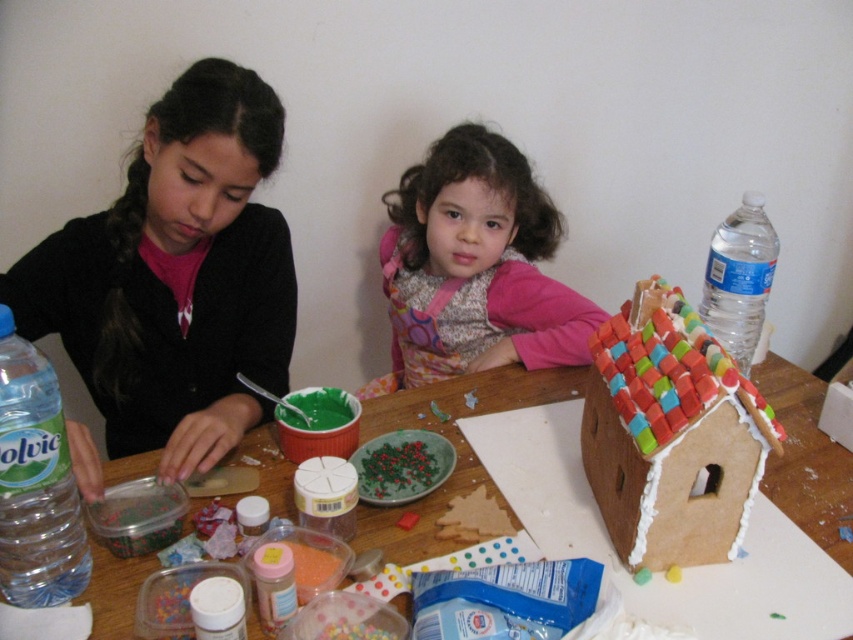
You are standing in front of the table where the children are decorating gingerbread houses. You need to place a new container of candy decorations exactly at point (474, 268). Where should you place it?

Place the candy decorations at point (474, 268) on the fluffy pink sweater at upper center.